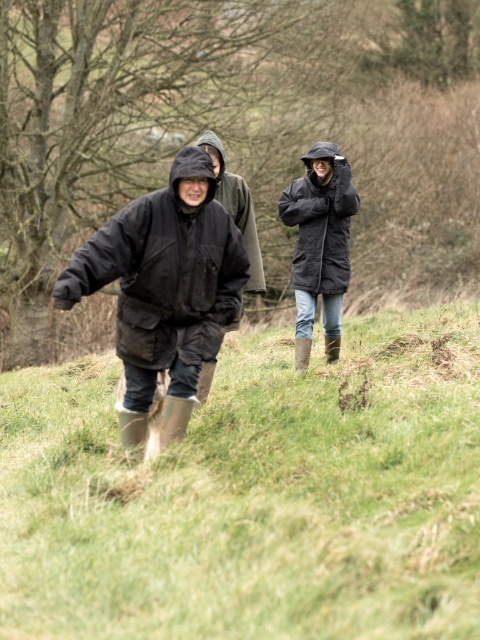
You are planning to set up a tent for a small group. The tent requires a space where the ground is both flat and has enough width to accommodate it. Given the green grassy at lower left and the black matte jacket at center, which location would be more suitable for setting up the tent?

The green grassy at lower left is thinner than the black matte jacket at center, so the black matte jacket at center area is wider and flatter, making it more suitable for setting up the tent.

You are a hiker who needs to place a 3.5 meter long tent between the green grassy at lower left and the black matte jacket at upper center. Can you fit the tent between them?

The distance between the green grassy at lower left and the black matte jacket at upper center is 4.04 meters, so yes, the tent can be placed between them as it is shorter than the available space.